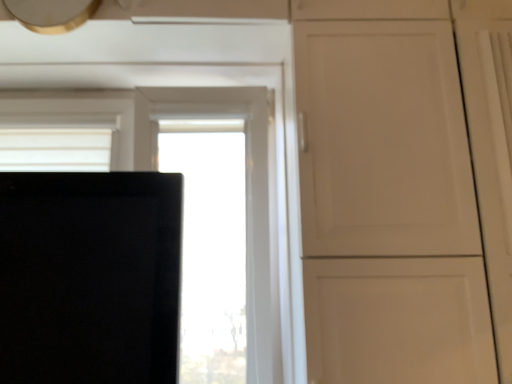
Question: Is transparent glass window at center next to metallic gold exhaust hood at upper left and touching it?

Choices:
 (A) no
 (B) yes

Answer: (A)

Question: Does transparent glass window at center have a larger size compared to metallic gold exhaust hood at upper left?

Choices:
 (A) yes
 (B) no

Answer: (A)

Question: From the image's perspective, would you say transparent glass window at center is shown under metallic gold exhaust hood at upper left?

Choices:
 (A) no
 (B) yes

Answer: (B)

Question: Does transparent glass window at center have a lesser width compared to metallic gold exhaust hood at upper left?

Choices:
 (A) yes
 (B) no

Answer: (B)

Question: Can metallic gold exhaust hood at upper left be found inside transparent glass window at center?

Choices:
 (A) yes
 (B) no

Answer: (B)

Question: Is transparent glass window at center positioned behind metallic gold exhaust hood at upper left?

Choices:
 (A) yes
 (B) no

Answer: (A)

Question: Is metallic gold exhaust hood at upper left oriented away from transparent glass window at center?

Choices:
 (A) no
 (B) yes

Answer: (A)

Question: Is transparent glass window at center inside metallic gold exhaust hood at upper left?

Choices:
 (A) no
 (B) yes

Answer: (A)

Question: Does metallic gold exhaust hood at upper left have a lesser height compared to transparent glass window at center?

Choices:
 (A) yes
 (B) no

Answer: (A)

Question: From a real-world perspective, is metallic gold exhaust hood at upper left on top of transparent glass window at center?

Choices:
 (A) yes
 (B) no

Answer: (A)

Question: From the image's perspective, is metallic gold exhaust hood at upper left located above transparent glass window at center?

Choices:
 (A) no
 (B) yes

Answer: (B)

Question: Is metallic gold exhaust hood at upper left outside transparent glass window at center?

Choices:
 (A) yes
 (B) no

Answer: (A)

Question: In terms of height, does transparent glass window at center look taller or shorter compared to metallic gold exhaust hood at upper left?

Choices:
 (A) short
 (B) tall

Answer: (B)